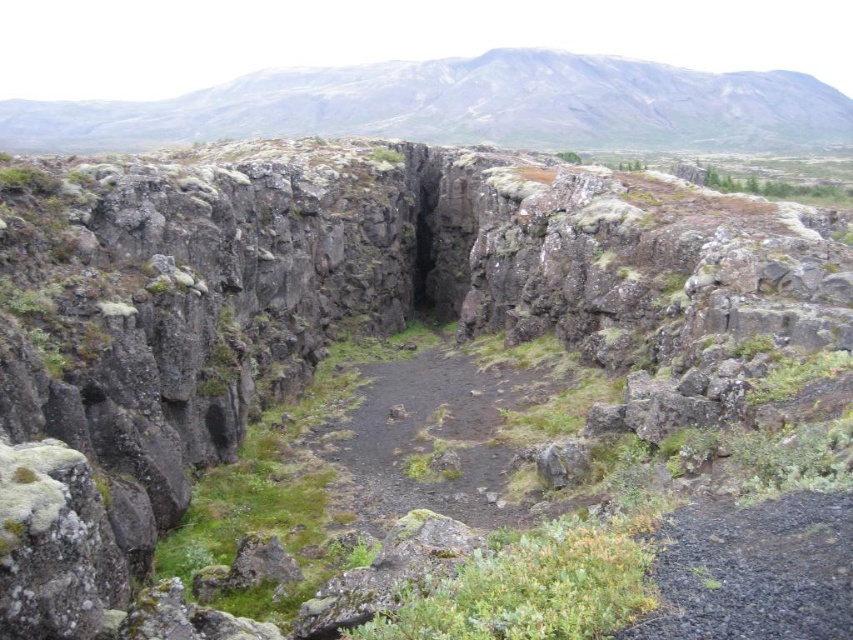
Is gray rocky mountain at upper center taller than dull gray dirt path at center?

Indeed, gray rocky mountain at upper center has a greater height compared to dull gray dirt path at center.

Is gray rocky mountain at upper center shorter than dull gray dirt path at center?

No.

Identify the location of gray rocky mountain at upper center. (462, 106).